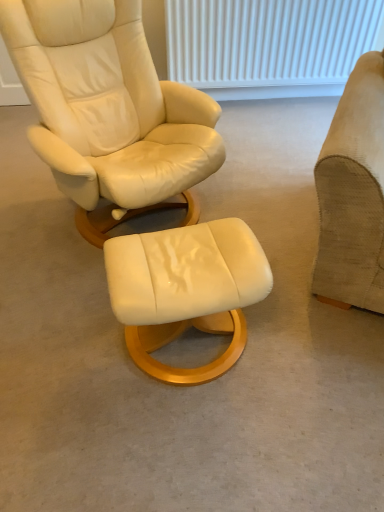
At what (x,y) coordinates should I click in order to perform the action: click on free point below white textured radiator at upper center (from a real-world perspective). Please return your answer as a coordinate pair (x, y). Looking at the image, I should click on (278, 104).